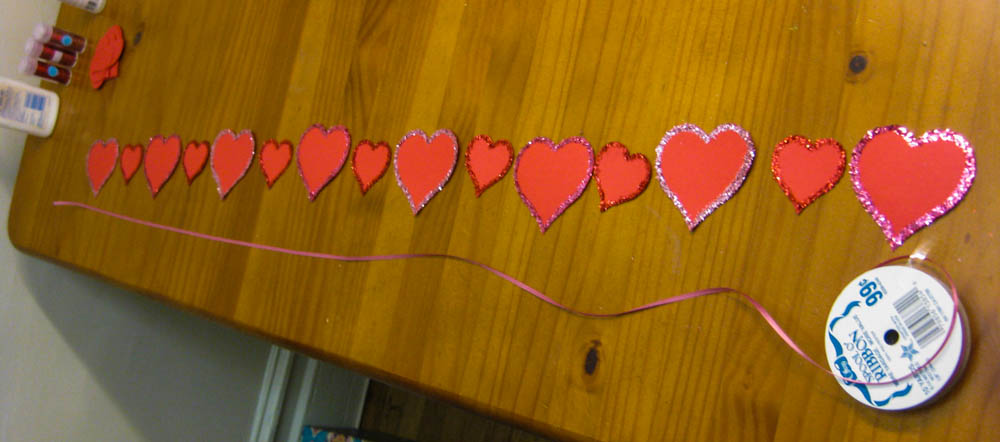
This screenshot has height=442, width=1000. I want to click on knots in wood table, so click(x=595, y=340), click(x=865, y=71).